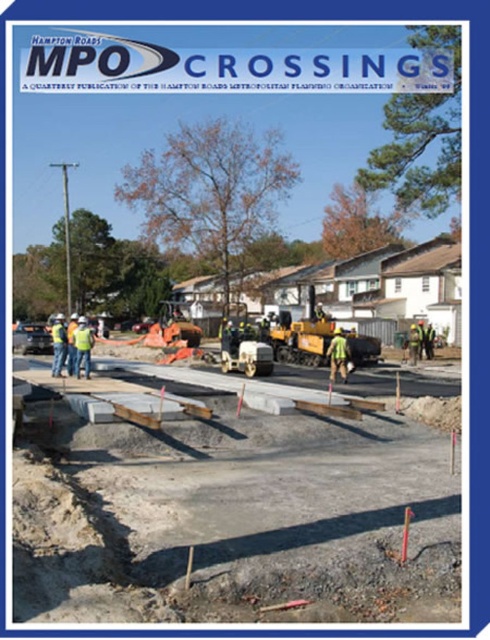
You are a construction worker standing at the point marked by the coordinates point (224,504). Looking around, you see gray concrete slabs at center. What is directly under your feet?

The point (224,504) indicates gray concrete slabs at center, so the gray concrete slabs at center are directly under your feet.

You are a construction worker standing at the edge of the road. You need to pick up the green reflective safety vest at center. Which object is closer to you, the gray concrete slabs at center or the vest?

The gray concrete slabs at center are closer to you than the green reflective safety vest at center, so you should reach for the gray concrete slabs at center first before the vest.

You are a construction supervisor planning to place a new safety barrier at coordinate point 0.5, 0.6. Is the yellow asphalt paver at center within 0.1 units of this point?

The yellow asphalt paver at center is located at point (302,333), which is within 0.1 units of the desired coordinate point (294,320). Therefore, placing the safety barrier there may interfere with the paver.